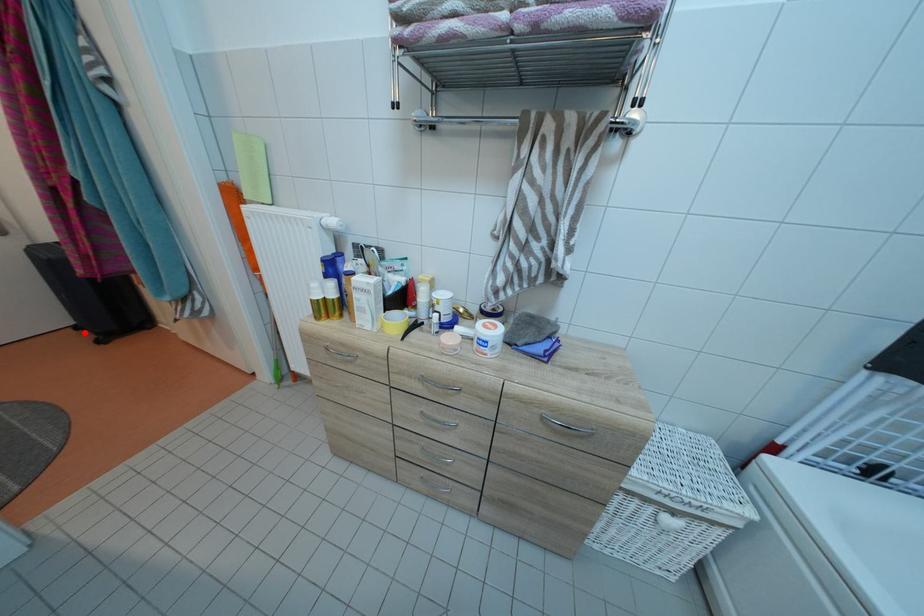
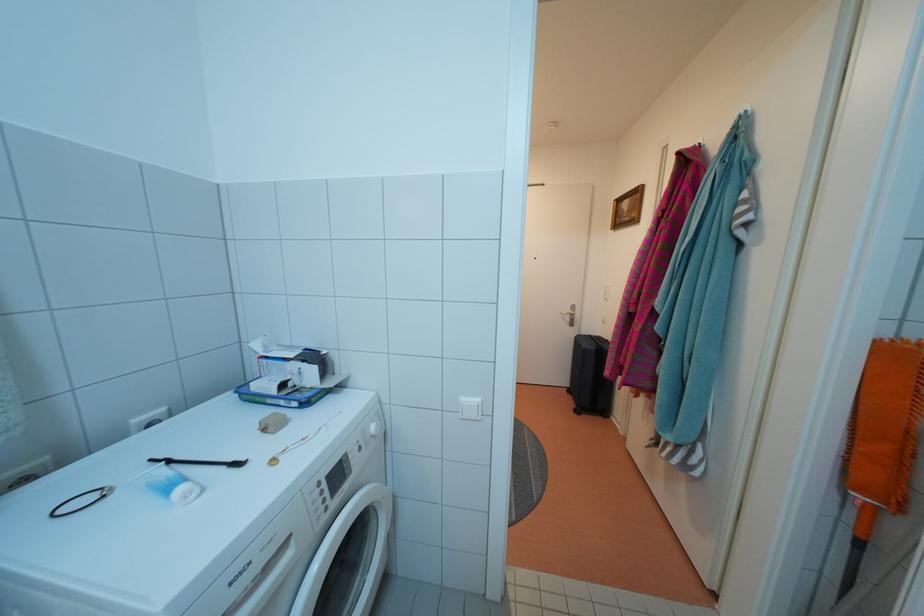
Locate, in the second image, the point that corresponds to the highlighted location in the first image.

(576, 397)